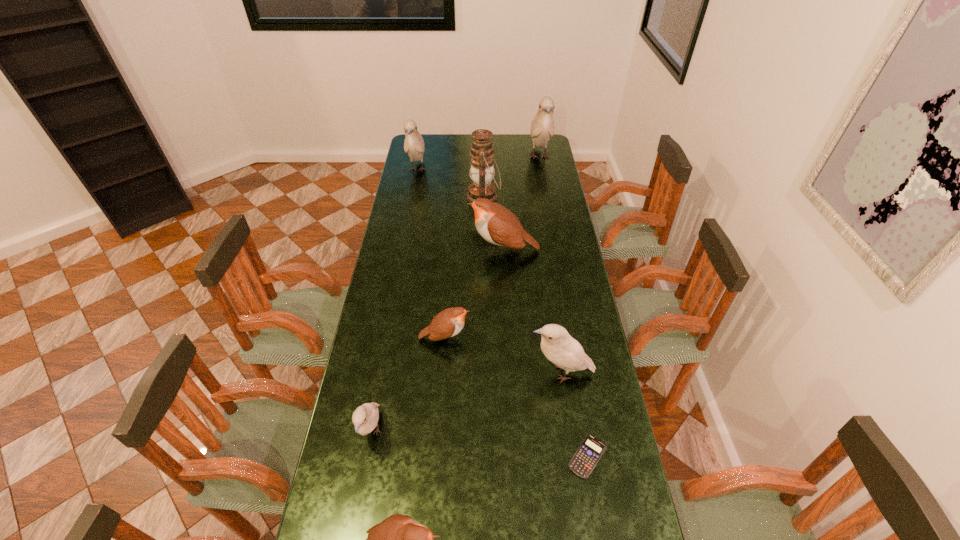
The width and height of the screenshot is (960, 540). In order to click on free space located at the beak of the third nearest bird in this screenshot , I will do `click(425, 373)`.

Locate an element on the screen. vacant area situated 0.300m at the beak of the third nearest bird is located at coordinates (435, 373).

Identify the location of free region located at the beak of the smallest white bird. This screenshot has width=960, height=540. (362, 490).

This screenshot has height=540, width=960. I want to click on free space located 0.300m at the face of the fifth farthest object, so click(558, 338).

Where is `free space located on the front of the blue calculator`? free space located on the front of the blue calculator is located at coordinates point(602,538).

You are a GUI agent. You are given a task and a screenshot of the screen. Output one action in this format:
    pyautogui.click(x=<x>, y=<y>)
    Task: Click on the object located in the far edge section of the desktop
    The image size is (960, 540).
    Given the screenshot: What is the action you would take?
    pyautogui.click(x=542, y=127)

What are the coordinates of `calculator at the right edge` in the screenshot? It's located at (585, 459).

Identify the location of object located in the far right corner section of the desktop. The width and height of the screenshot is (960, 540). (542, 127).

This screenshot has height=540, width=960. In the image, there is a desktop. What are the coordinates of `vacant area at the far edge` in the screenshot? It's located at (459, 134).

This screenshot has height=540, width=960. Identify the location of vacant region at the left edge of the desktop. (374, 291).